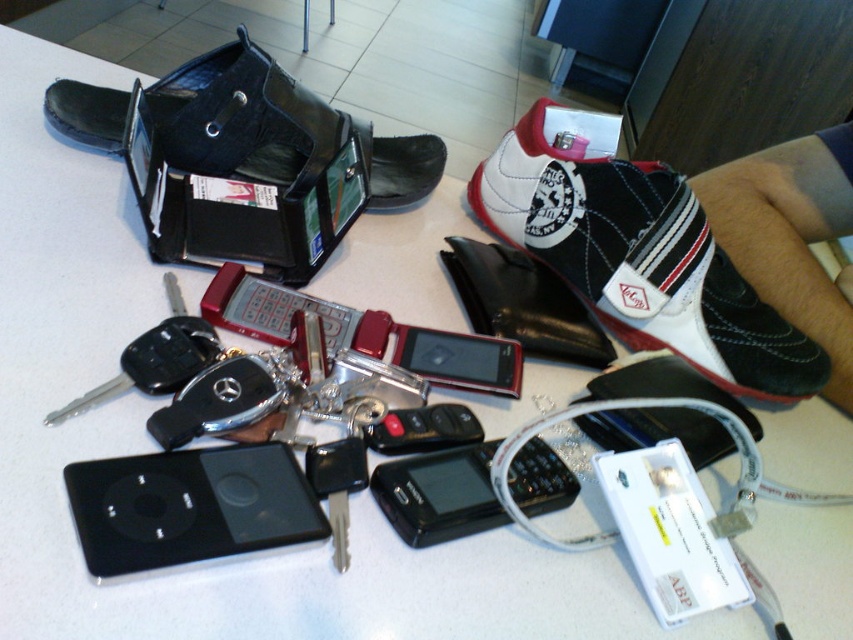
You are organizing items on a table and need to place a new item between the white leather shoe at upper right and the black glossy smartphone at center. What is the minimum distance you need to maintain between these two items to ensure the new item fits?

The white leather shoe at upper right and the black glossy smartphone at center are 11.21 inches apart from each other. To place a new item between them, the minimum distance required would be just over 11.21 inches to accommodate the new item without overlapping.

You are looking at the image and want to pick up the item closest to you. Which point should you reach for, point at (624, 512) or point at (277, 154)?

Point at (624, 512) is closer to the viewer, so you should reach for that point.